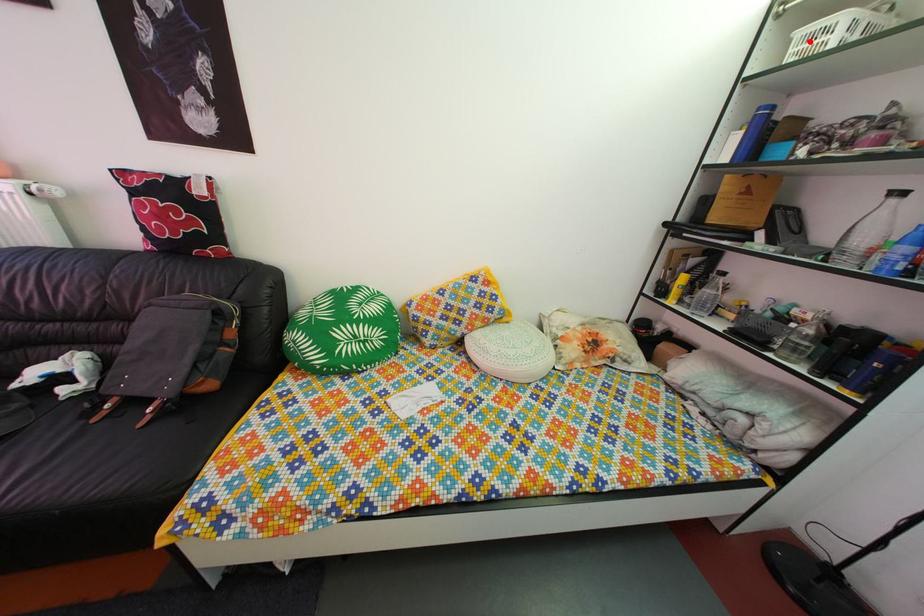
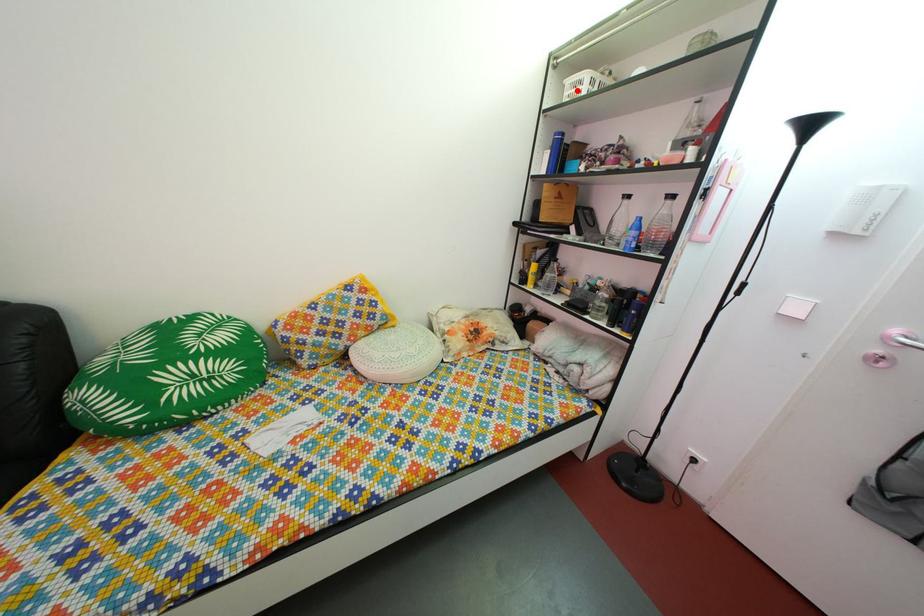
I am providing you with two images of the same scene from different viewpoints. A red point is marked on the first image and another point is marked on the second image. Is the red point in image1 aligned with the point shown in image2?

Yes